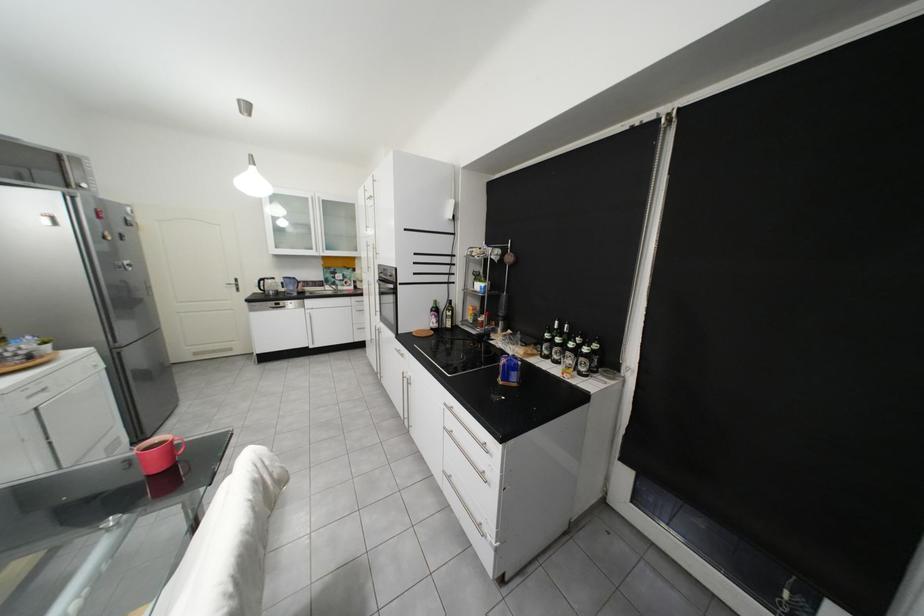
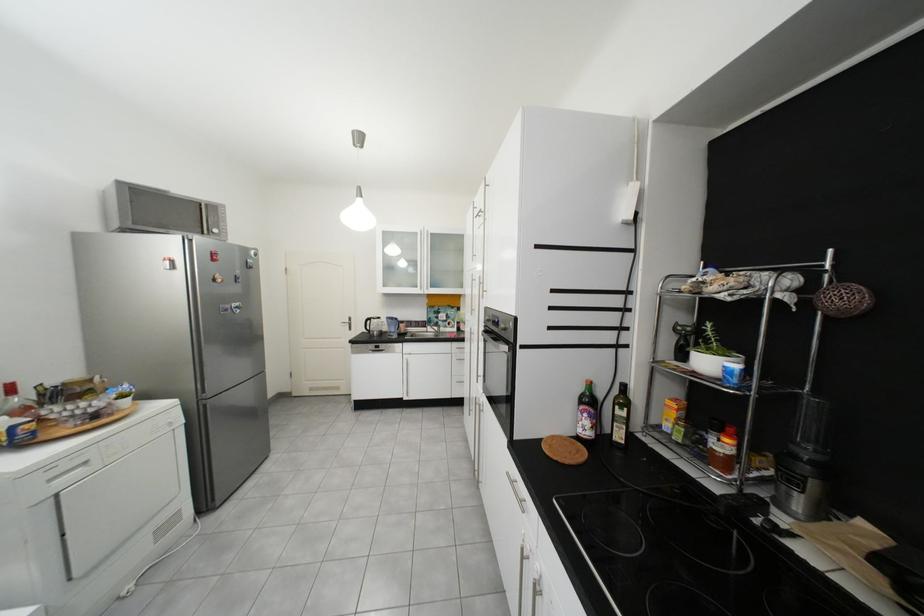
Find the pixel in the second image that matches [249,286] in the first image.

(361, 325)